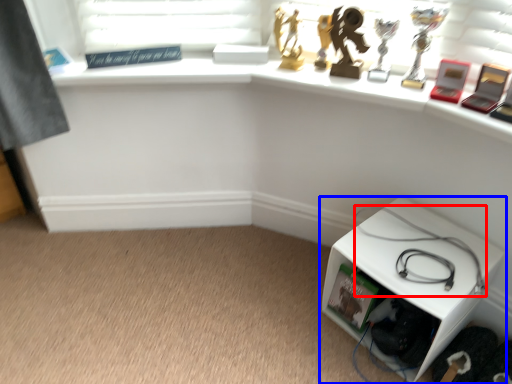
Question: Which point is closer to the camera, cable (highlighted by a red box) or furniture (highlighted by a blue box)?

Choices:
 (A) cable
 (B) furniture

Answer: (B)